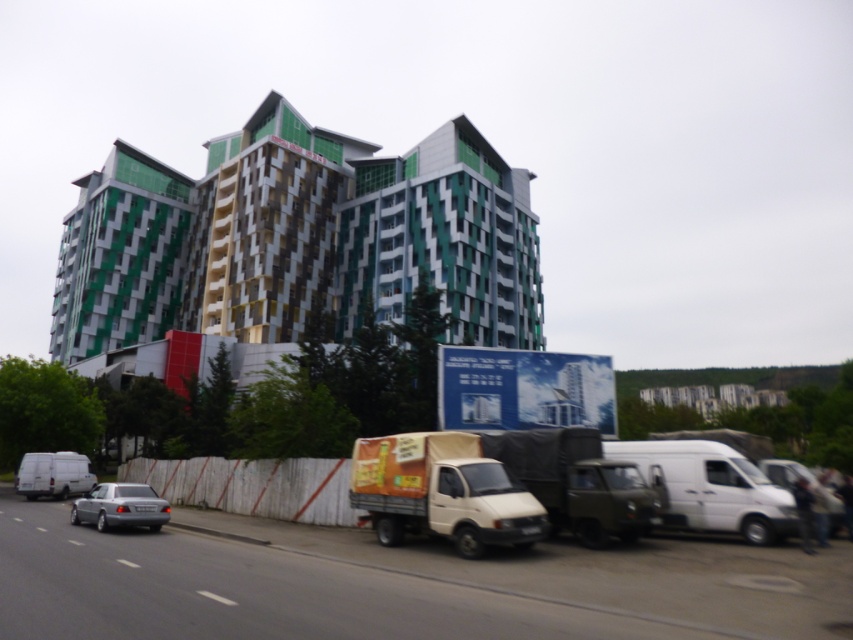
You are a delivery driver who needs to park your white matte van at lower right next to the white matte truck at center. Can your van fit in the available space between the truck and the building?

The white matte truck at center is wider than the white matte van at lower right, so there should be enough space for the van to park next to the truck as long as the total width of both vehicles doesn

You are a delivery driver who needs to park your truck between the white matte van at lower right and the silver metallic sedan at lower left. The truck requires 20 feet of space. Is there enough space between them?

The white matte van at lower right and the silver metallic sedan at lower left are 40.87 feet apart from each other. Since the truck requires 20 feet of space, there is sufficient space between them for parking.